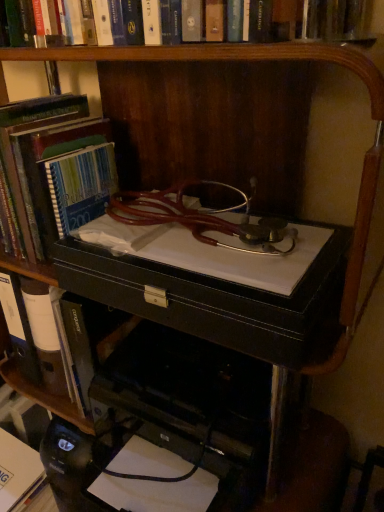
Where is `free space above white paper at lower left, marked as the third book in a top-to-bottom arrangement (from a real-world perspective)`? Image resolution: width=384 pixels, height=512 pixels. free space above white paper at lower left, marked as the third book in a top-to-bottom arrangement (from a real-world perspective) is located at coordinates (11, 456).